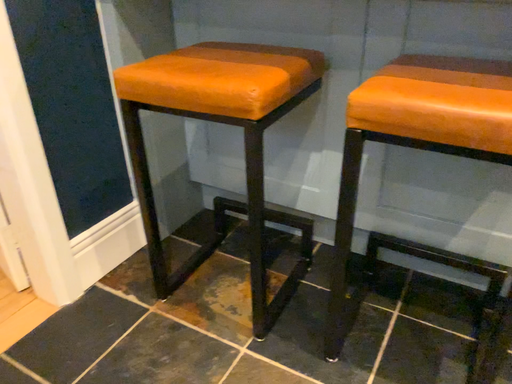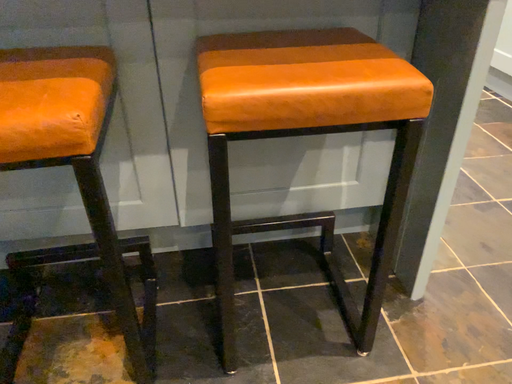
Question: Which way did the camera rotate in the video?

Choices:
 (A) rotated right
 (B) rotated left

Answer: (A)